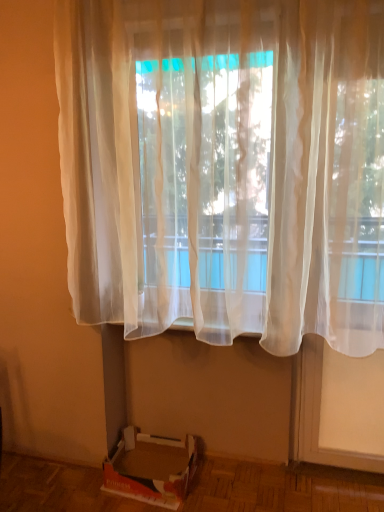
Describe the element at coordinates (151, 468) in the screenshot. I see `cardboard box at lower left` at that location.

Find the location of a particular element. Image resolution: width=384 pixels, height=512 pixels. cardboard box at lower left is located at coordinates (151, 468).

What do you see at coordinates (225, 168) in the screenshot?
I see `translucent white curtain at center` at bounding box center [225, 168].

What is the approximate width of translucent white curtain at center?

19.60 centimeters.

The height and width of the screenshot is (512, 384). In order to click on translucent white curtain at center in this screenshot , I will do `click(225, 168)`.

The width and height of the screenshot is (384, 512). I want to click on cardboard box at lower left, so click(151, 468).

Is cardboard box at lower left at the right side of translucent white curtain at center?

Incorrect, cardboard box at lower left is not on the right side of translucent white curtain at center.

Is cardboard box at lower left further to camera compared to translucent white curtain at center?

Yes, it is.

Which point is more distant from viewer, (186, 474) or (156, 305)?

The point (186, 474) is farther.

From the image's perspective, is cardboard box at lower left above or below translucent white curtain at center?

From the image's perspective, cardboard box at lower left appears below translucent white curtain at center.

Consider the image. From a real-world perspective, is cardboard box at lower left beneath translucent white curtain at center?

Indeed, from a real-world perspective, cardboard box at lower left is positioned beneath translucent white curtain at center.

Which object is thinner, cardboard box at lower left or translucent white curtain at center?

Thinner between the two is translucent white curtain at center.

Is cardboard box at lower left taller than translucent white curtain at center?

In fact, cardboard box at lower left may be shorter than translucent white curtain at center.

Is cardboard box at lower left bigger than translucent white curtain at center?

Incorrect, cardboard box at lower left is not larger than translucent white curtain at center.

Can we say cardboard box at lower left lies outside translucent white curtain at center?

Indeed, cardboard box at lower left is completely outside translucent white curtain at center.

In the scene shown: Is cardboard box at lower left touching translucent white curtain at center?

There is a gap between cardboard box at lower left and translucent white curtain at center.

Could you tell me if cardboard box at lower left is facing translucent white curtain at center?

No, cardboard box at lower left does not turn towards translucent white curtain at center.

How many degrees apart are the facing directions of cardboard box at lower left and translucent white curtain at center?

They differ by 0.0473 degrees in their facing directions.

Identify the location of curtain above the cardboard box at lower left (from a real-world perspective). The height and width of the screenshot is (512, 384). (225, 168).

Between translucent white curtain at center and cardboard box at lower left, which one appears on the right side from the viewer's perspective?

Positioned to the right is translucent white curtain at center.

Based on the photo, which object is further away from the camera taking this photo, translucent white curtain at center or cardboard box at lower left?

cardboard box at lower left is further from the camera.

Which is farther, (378,21) or (167,459)?

The point (167,459) is behind.

From the picture: From the image's perspective, between translucent white curtain at center and cardboard box at lower left, which one is located above?

From the image's view, translucent white curtain at center is above.

Based on the photo, from a real-world perspective, which object rests below the other?

From a 3D spatial view, cardboard box at lower left is below.

Is translucent white curtain at center thinner than cardboard box at lower left?

Indeed, translucent white curtain at center has a lesser width compared to cardboard box at lower left.

Which of these two, translucent white curtain at center or cardboard box at lower left, stands taller?

With more height is translucent white curtain at center.

Considering the sizes of translucent white curtain at center and cardboard box at lower left in the image, is translucent white curtain at center bigger or smaller than cardboard box at lower left?

translucent white curtain at center is bigger than cardboard box at lower left.

Is translucent white curtain at center situated inside cardboard box at lower left or outside?

translucent white curtain at center is spatially situated outside cardboard box at lower left.

Is translucent white curtain at center far from cardboard box at lower left?

translucent white curtain at center is far away from cardboard box at lower left.

Is translucent white curtain at center oriented away from cardboard box at lower left?

translucent white curtain at center is not turned away from cardboard box at lower left.

How different are the orientations of translucent white curtain at center and cardboard box at lower left in degrees?

The angular difference between translucent white curtain at center and cardboard box at lower left is 0.0473 degrees.

This screenshot has height=512, width=384. What are the coordinates of `cardboard box below the translucent white curtain at center (from a real-world perspective)` in the screenshot? It's located at (151, 468).

In order to click on cardboard box below the translucent white curtain at center (from the image's perspective) in this screenshot , I will do 151,468.

Where is `curtain that appears in front of the cardboard box at lower left`? The image size is (384, 512). curtain that appears in front of the cardboard box at lower left is located at coordinates coord(225,168).